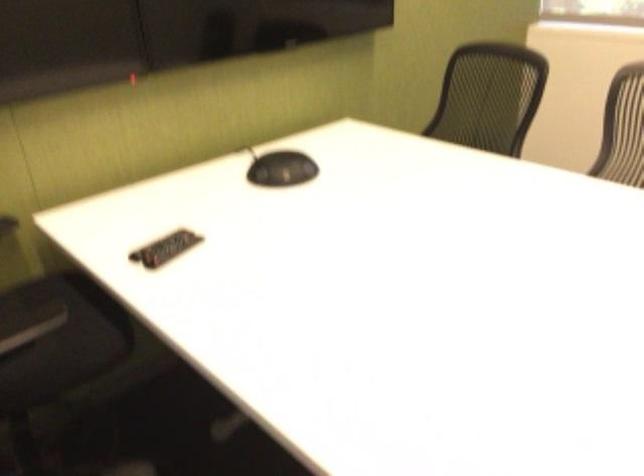
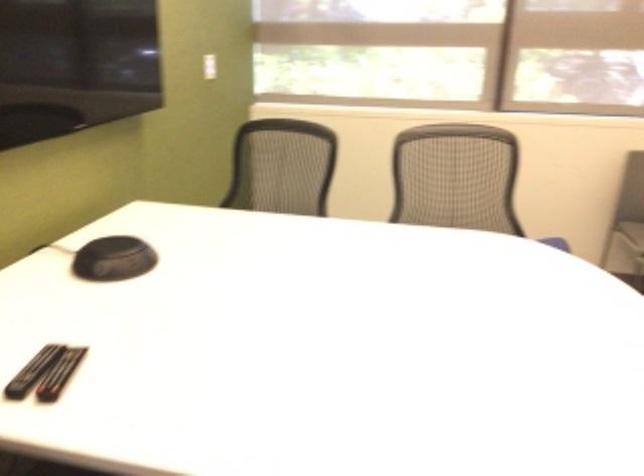
Find the pixel in the second image that matches point (270, 168) in the first image.

(113, 259)